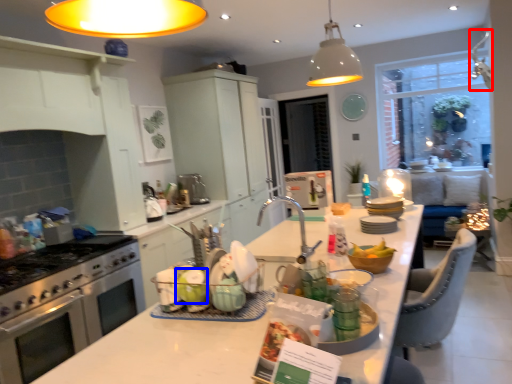
Question: Which point is closer to the camera, lamp (highlighted by a red box) or table (highlighted by a blue box)?

Choices:
 (A) lamp
 (B) table

Answer: (B)